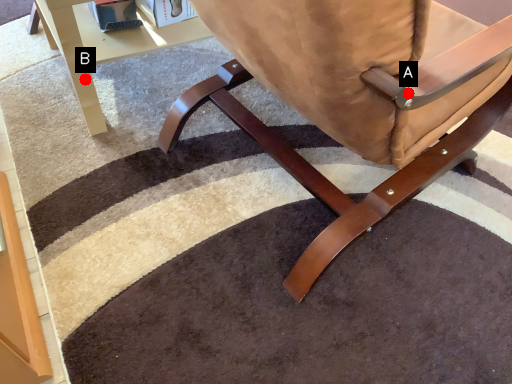
Question: Two points are circled on the image, labeled by A and B beside each circle. Which point is farther to the camera?

Choices:
 (A) A is further
 (B) B is further

Answer: (B)